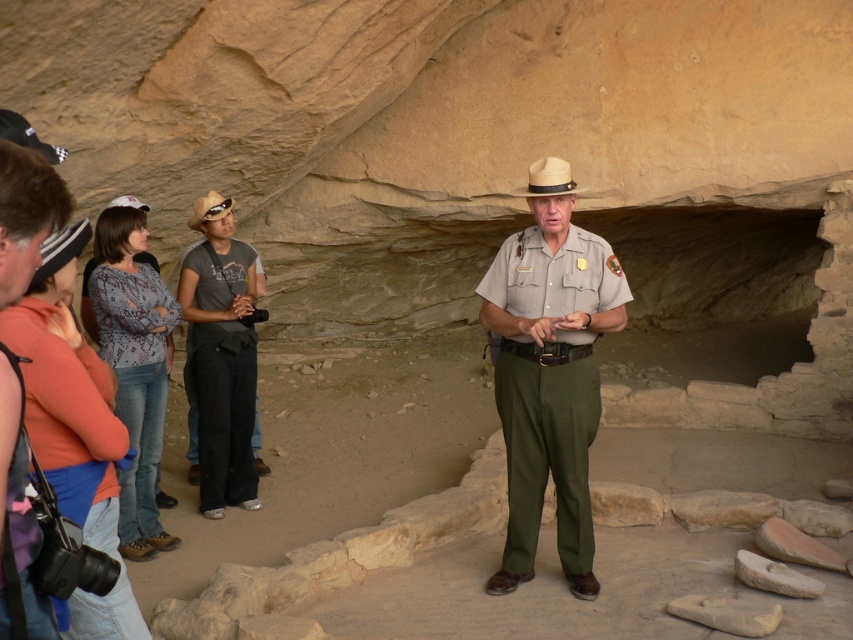
Question: Which of these objects is positioned farthest from the light brown straw cowboy hat at center?

Choices:
 (A) patterned fabric shirt at left
 (B) brown straw cowboy hat at center
 (C) orange cotton shirt at left

Answer: (A)

Question: Which object appears closest to the camera in this image?

Choices:
 (A) gray cotton shirt at center
 (B) orange cotton shirt at left

Answer: (B)

Question: Can you confirm if khaki uniform at center is thinner than light brown straw cowboy hat at center?

Choices:
 (A) no
 (B) yes

Answer: (A)

Question: Does orange cotton shirt at left appear on the right side of brown straw cowboy hat at center?

Choices:
 (A) yes
 (B) no

Answer: (A)

Question: Considering the real-world distances, which object is closest to the patterned fabric shirt at left?

Choices:
 (A) gray cotton shirt at center
 (B) brown straw cowboy hat at center
 (C) light brown straw cowboy hat at center
 (D) orange cotton shirt at left

Answer: (A)

Question: Considering the relative positions of khaki uniform at center and orange cotton shirt at left in the image provided, where is khaki uniform at center located with respect to orange cotton shirt at left?

Choices:
 (A) right
 (B) left

Answer: (A)